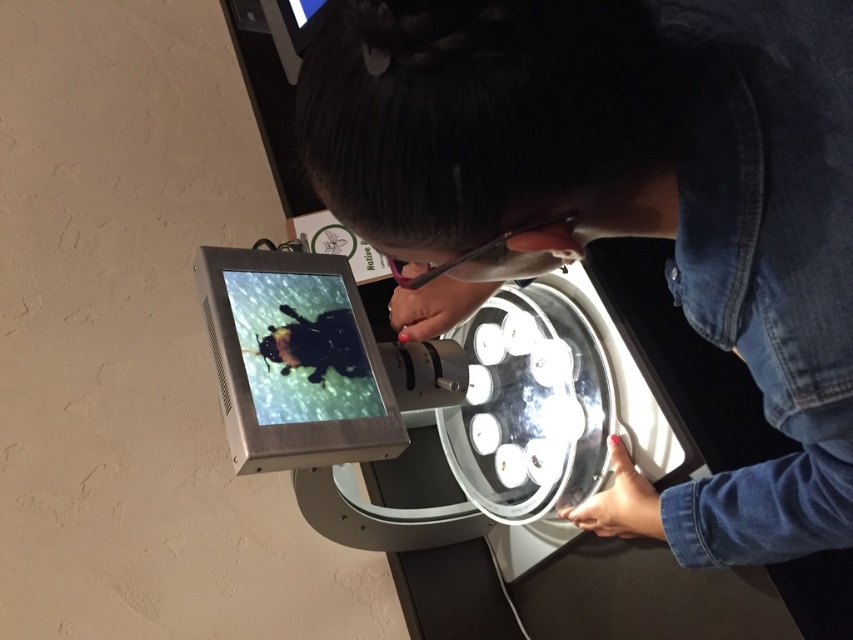
You are standing in a lab and see a point at coordinates (622,204). What object is located at that point?

The denim jacket at center is located at point (622,204).

You are a researcher who needs to adjust the microscope settings. You see the denim jacket at center and the matte black screen at center. Which object is positioned to the left?

The matte black screen at center is to the left of the denim jacket at center.

Looking at this image, you are a researcher who needs to adjust the focus of the microscope. You notice the denim jacket at center and the matte black screen at center. Which object is positioned higher in your field of view?

The denim jacket at center is much taller than the matte black screen at center, so it is positioned higher in your field of view.